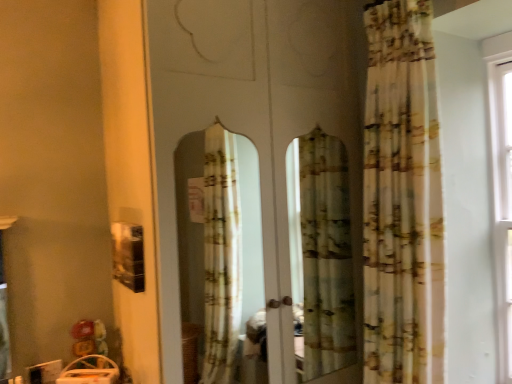
Question: Considering the relative positions of transparent glass screen door at center and printed fabric curtain at right in the image provided, is transparent glass screen door at center to the left or to the right of printed fabric curtain at right?

Choices:
 (A) right
 (B) left

Answer: (B)

Question: Is transparent glass screen door at center situated inside printed fabric curtain at right or outside?

Choices:
 (A) outside
 (B) inside

Answer: (A)

Question: In terms of width, does transparent glass screen door at center look wider or thinner when compared to printed fabric curtain at right?

Choices:
 (A) thin
 (B) wide

Answer: (B)

Question: Based on their positions, is printed fabric curtain at right located to the left or right of transparent glass screen door at center?

Choices:
 (A) right
 (B) left

Answer: (A)

Question: From a real-world perspective, is printed fabric curtain at right physically located above or below transparent glass screen door at center?

Choices:
 (A) below
 (B) above

Answer: (B)

Question: Is printed fabric curtain at right spatially inside transparent glass screen door at center, or outside of it?

Choices:
 (A) outside
 (B) inside

Answer: (A)

Question: From their relative heights in the image, would you say printed fabric curtain at right is taller or shorter than transparent glass screen door at center?

Choices:
 (A) tall
 (B) short

Answer: (B)